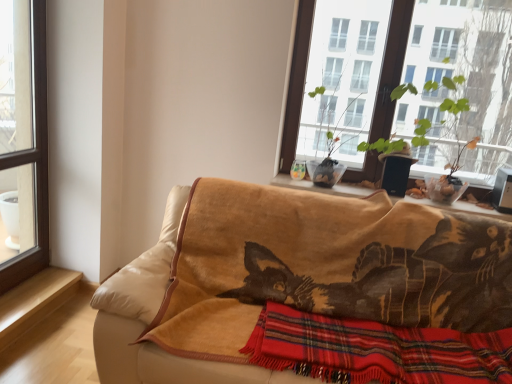
In order to click on vacant space situated above light brown wood at lower left, the 2th window sill positioned from the right (from a real-world perspective) in this screenshot , I will do `click(31, 290)`.